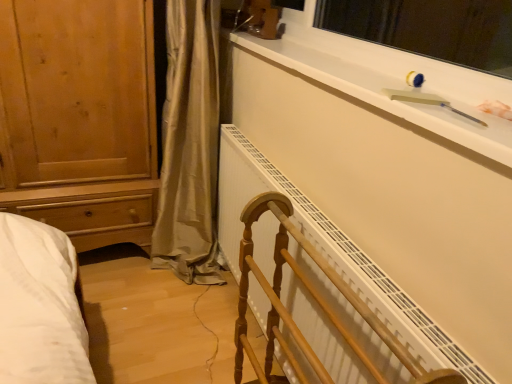
Question: Is white matte window sill at upper right shorter than white plastic window screen at upper right?

Choices:
 (A) no
 (B) yes

Answer: (B)

Question: Considering the relative positions of white matte window sill at upper right and white plastic window screen at upper right in the image provided, is white matte window sill at upper right in front of white plastic window screen at upper right?

Choices:
 (A) no
 (B) yes

Answer: (B)

Question: Can you confirm if white matte window sill at upper right is positioned to the right of white plastic window screen at upper right?

Choices:
 (A) no
 (B) yes

Answer: (A)

Question: Is white matte window sill at upper right taller than white plastic window screen at upper right?

Choices:
 (A) no
 (B) yes

Answer: (A)

Question: Is white matte window sill at upper right smaller than white plastic window screen at upper right?

Choices:
 (A) yes
 (B) no

Answer: (A)

Question: In terms of height, does wooden towel rack at center look taller or shorter compared to white plastic window screen at upper right?

Choices:
 (A) tall
 (B) short

Answer: (A)

Question: From the image's perspective, is wooden towel rack at center above or below white plastic window screen at upper right?

Choices:
 (A) above
 (B) below

Answer: (B)

Question: Based on their positions, is wooden towel rack at center located to the left or right of white plastic window screen at upper right?

Choices:
 (A) left
 (B) right

Answer: (A)

Question: Is wooden towel rack at center inside or outside of white plastic window screen at upper right?

Choices:
 (A) outside
 (B) inside

Answer: (A)

Question: Considering their positions, is white matte window sill at upper right located in front of or behind wooden towel rack at center?

Choices:
 (A) behind
 (B) front

Answer: (A)

Question: Looking at the image, does white matte window sill at upper right seem bigger or smaller compared to wooden towel rack at center?

Choices:
 (A) small
 (B) big

Answer: (A)

Question: Considering the relative positions of white matte window sill at upper right and wooden towel rack at center in the image provided, is white matte window sill at upper right to the left or to the right of wooden towel rack at center?

Choices:
 (A) left
 (B) right

Answer: (B)

Question: Looking at their shapes, would you say white matte window sill at upper right is wider or thinner than wooden towel rack at center?

Choices:
 (A) thin
 (B) wide

Answer: (A)

Question: From the image's perspective, is white plastic window screen at upper right above or below white matte window sill at upper right?

Choices:
 (A) above
 (B) below

Answer: (A)

Question: From a real-world perspective, is white plastic window screen at upper right above or below white matte window sill at upper right?

Choices:
 (A) below
 (B) above

Answer: (B)